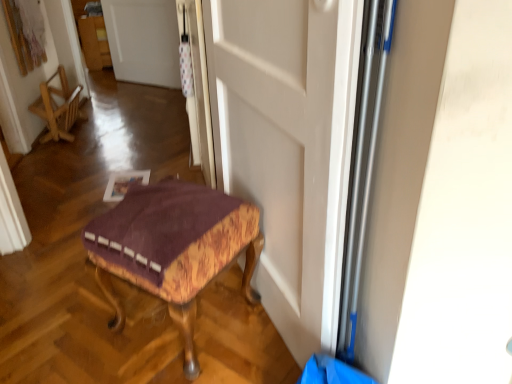
The image size is (512, 384). Find the location of `vacant space to the left of velvet purple cushioned stool at lower center`. vacant space to the left of velvet purple cushioned stool at lower center is located at coordinates pyautogui.click(x=68, y=325).